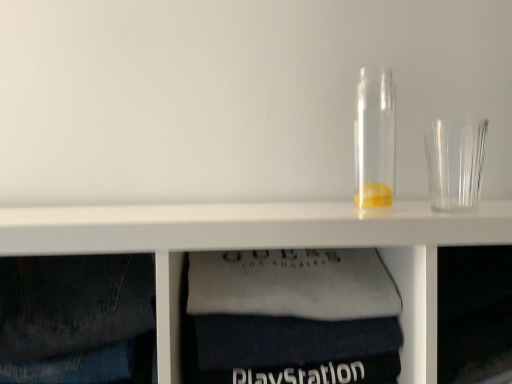
Question: From the image's perspective, is transparent glass jar at center beneath transparent plastic shot glass at right?

Choices:
 (A) yes
 (B) no

Answer: (B)

Question: Would you consider transparent glass jar at center to be distant from transparent plastic shot glass at right?

Choices:
 (A) no
 (B) yes

Answer: (A)

Question: Is transparent glass jar at center looking in the opposite direction of transparent plastic shot glass at right?

Choices:
 (A) no
 (B) yes

Answer: (A)

Question: Considering the relative sizes of transparent glass jar at center and transparent plastic shot glass at right in the image provided, is transparent glass jar at center bigger than transparent plastic shot glass at right?

Choices:
 (A) no
 (B) yes

Answer: (B)

Question: Could transparent plastic shot glass at right be considered to be inside transparent glass jar at center?

Choices:
 (A) no
 (B) yes

Answer: (A)

Question: Is white fabric at lower center taller or shorter than transparent glass jar at center?

Choices:
 (A) tall
 (B) short

Answer: (A)

Question: Is white fabric at lower center wider or thinner than transparent glass jar at center?

Choices:
 (A) wide
 (B) thin

Answer: (A)

Question: From the image's perspective, is white fabric at lower center located above or below transparent glass jar at center?

Choices:
 (A) below
 (B) above

Answer: (A)

Question: Is white fabric at lower center inside the boundaries of transparent glass jar at center, or outside?

Choices:
 (A) inside
 (B) outside

Answer: (B)

Question: Relative to transparent plastic shot glass at right, is transparent glass jar at center in front or behind?

Choices:
 (A) behind
 (B) front

Answer: (A)

Question: Do you think transparent glass jar at center is within transparent plastic shot glass at right, or outside of it?

Choices:
 (A) outside
 (B) inside

Answer: (A)

Question: From a real-world perspective, is transparent glass jar at center positioned above or below transparent plastic shot glass at right?

Choices:
 (A) above
 (B) below

Answer: (A)

Question: In terms of height, does transparent glass jar at center look taller or shorter compared to transparent plastic shot glass at right?

Choices:
 (A) short
 (B) tall

Answer: (B)

Question: Considering the positions of transparent glass jar at center and white fabric at lower center in the image, is transparent glass jar at center wider or thinner than white fabric at lower center?

Choices:
 (A) thin
 (B) wide

Answer: (A)

Question: From the image's perspective, relative to white fabric at lower center, is transparent glass jar at center above or below?

Choices:
 (A) below
 (B) above

Answer: (B)